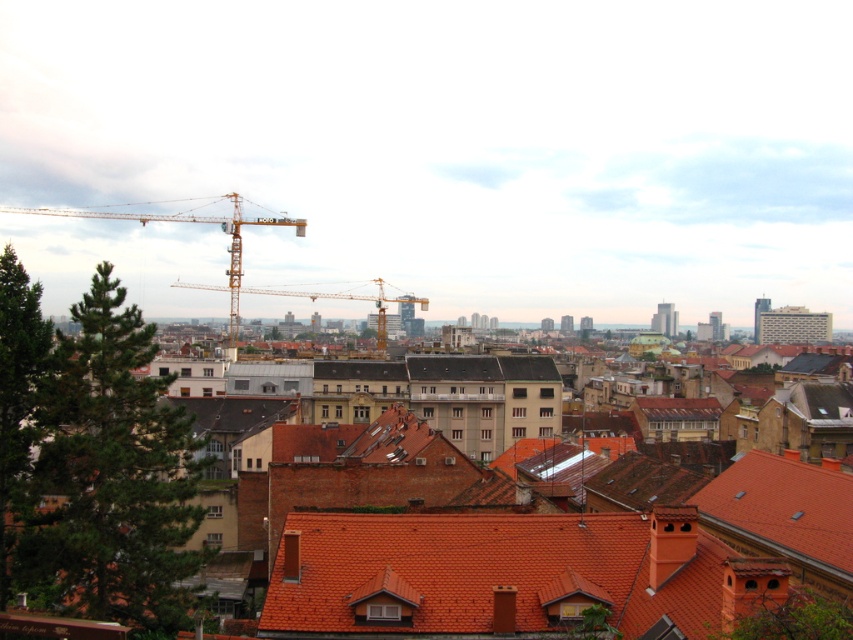
You are an architect analyzing the cityscape. You need to determine which object, the terracotta tiled roof at center or the metallic yellow crane at center, is taller. Based on the scene, which one is taller?

The metallic yellow crane at center is taller than the terracotta tiled roof at center.

You are an architect reviewing a city model. You notice the terracotta tiled roof at center and the metallic yellow crane at center. Which one is positioned to the right side in the model?

The terracotta tiled roof at center is positioned to the right of the metallic yellow crane at center in the model.

You are standing at the center of the city looking up. There is a point marked at coordinates point (238, 257). What object is located at this point?

The point (238, 257) marks the location of the yellow metallic crane at upper center.